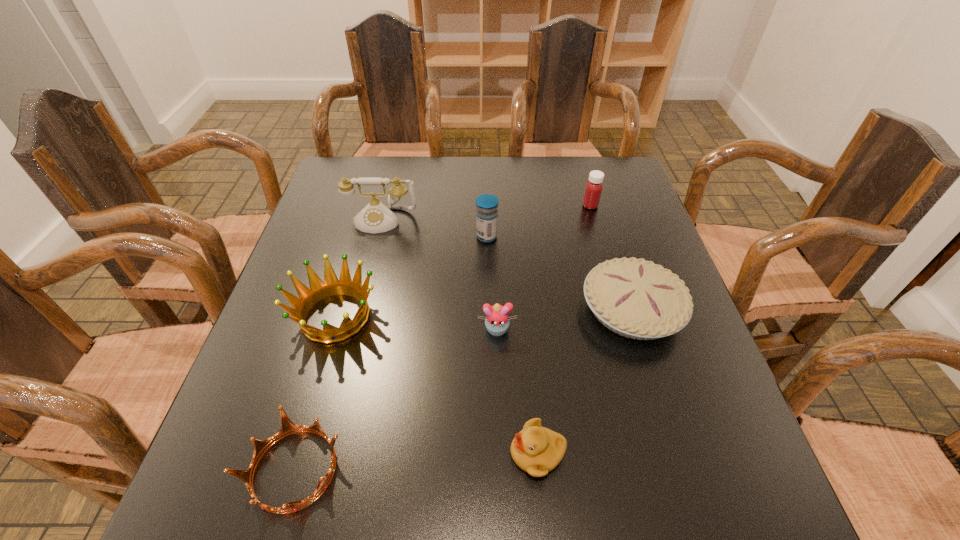
At what (x,y) coordinates should I click in order to perform the action: click on telephone. Please return your answer as a coordinate pair (x, y). This screenshot has height=540, width=960. Looking at the image, I should click on (376, 217).

Locate an element on the screen. the left medicine is located at coordinates (486, 214).

Identify the location of the farther medicine. This screenshot has height=540, width=960. (593, 190).

The width and height of the screenshot is (960, 540). I want to click on the farther crown, so click(x=319, y=290).

I want to click on cupcake, so click(497, 321).

Locate an element on the screen. pie is located at coordinates (635, 298).

Where is `duckling`? duckling is located at coordinates (537, 450).

The image size is (960, 540). Find the location of `the nearer crown`. the nearer crown is located at coordinates (288, 427).

Locate an element on the screen. Image resolution: width=960 pixels, height=540 pixels. vacant region located on the dial of the telephone is located at coordinates (369, 274).

Where is `vacant space situated 0.370m on the left of the left medicine`? The height and width of the screenshot is (540, 960). vacant space situated 0.370m on the left of the left medicine is located at coordinates (336, 237).